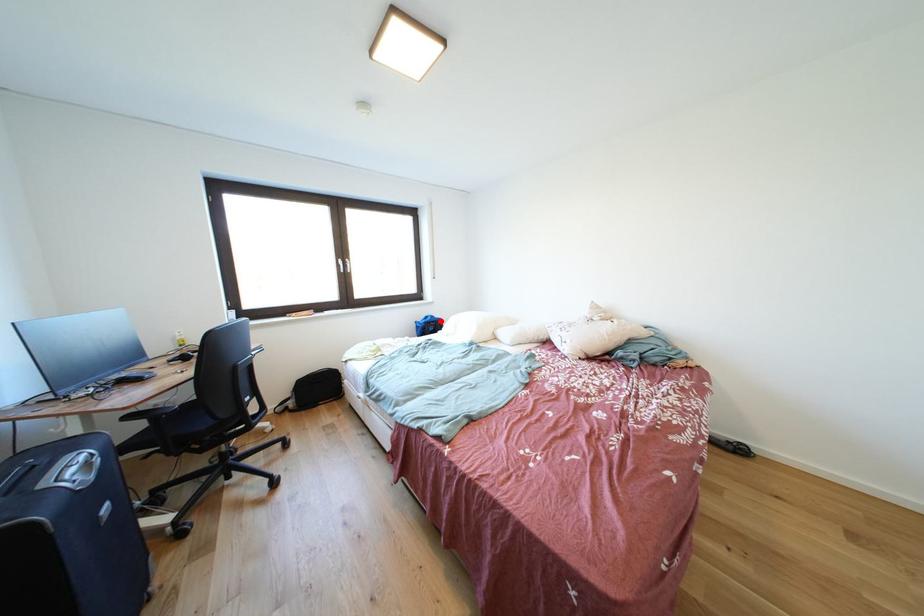
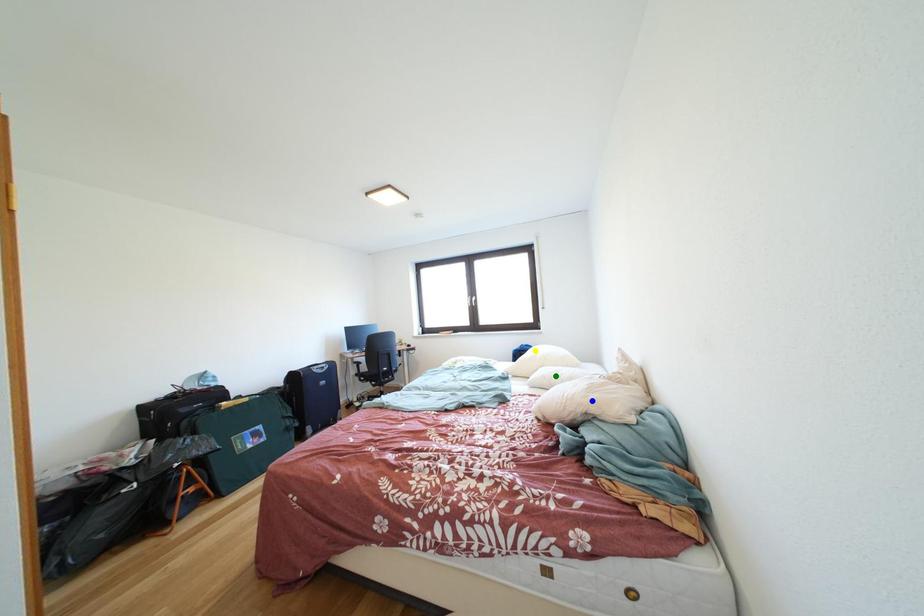
Question: I am providing you with two images of the same scene from different viewpoints. A red point is marked on the first image. You are given multiple points on the second image. Can you choose the point in image 2 that corresponds to the point in image 1?

Choices:
 (A) yellow point
 (B) green point
 (C) blue point

Answer: (A)